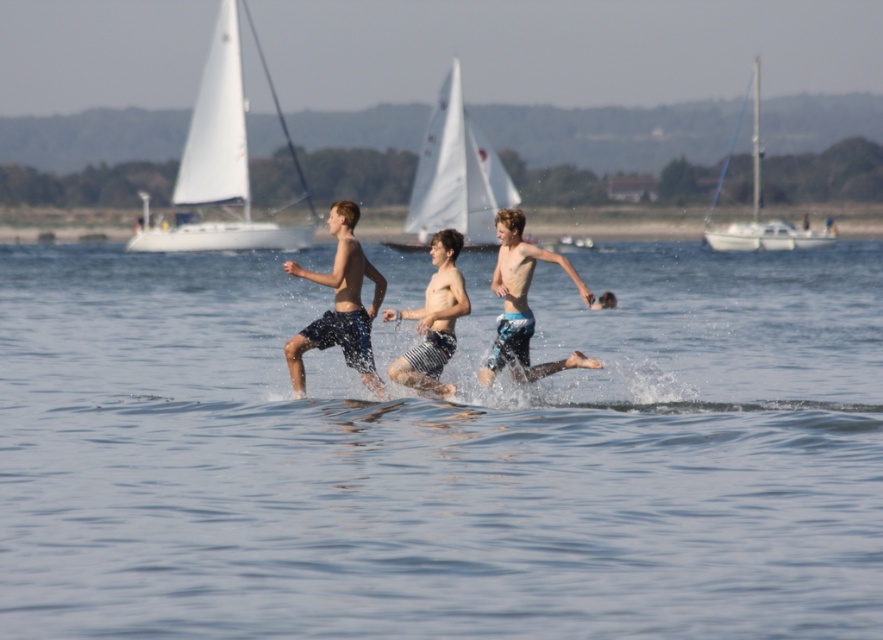
Question: Which object is positioned farthest from the clear blue water at center?

Choices:
 (A) blue patterned shorts at center
 (B) white sailboat at right
 (C) dark blue shorts at center
 (D) striped shorts at center

Answer: (B)

Question: Does dark blue shorts at center have a lesser width compared to striped shorts at center?

Choices:
 (A) no
 (B) yes

Answer: (A)

Question: In this image, where is blue patterned shorts at center located relative to white sailboat at right?

Choices:
 (A) above
 (B) below

Answer: (B)

Question: Does white sailboat at upper left have a smaller size compared to blue patterned shorts at center?

Choices:
 (A) yes
 (B) no

Answer: (B)

Question: Which of the following is the closest to the observer?

Choices:
 (A) white sailboat at right
 (B) striped shorts at center
 (C) blue patterned shorts at center
 (D) clear blue water at center

Answer: (D)

Question: Which is nearer to the white sailboat at upper left?

Choices:
 (A) striped shorts at center
 (B) white sailboat at right
 (C) clear blue water at center

Answer: (B)